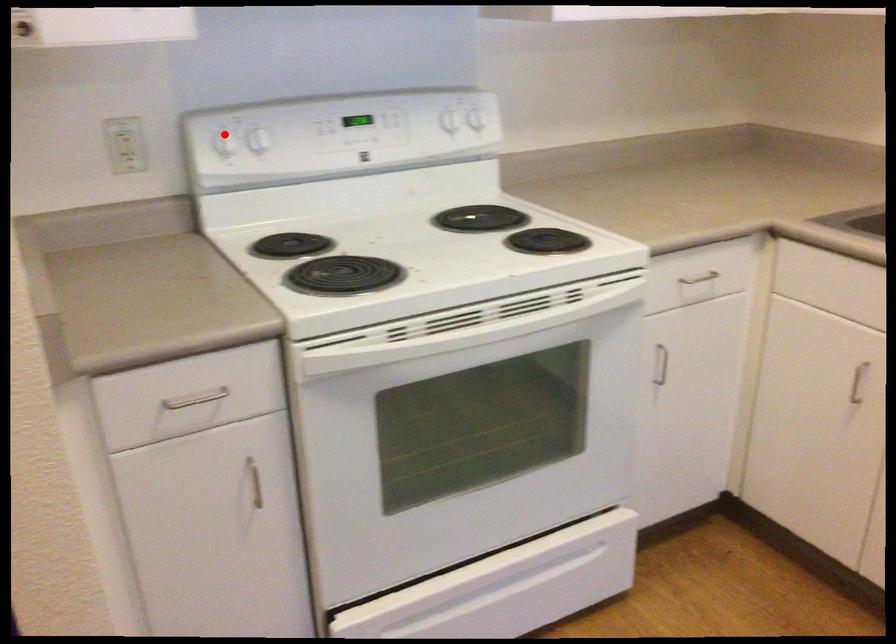
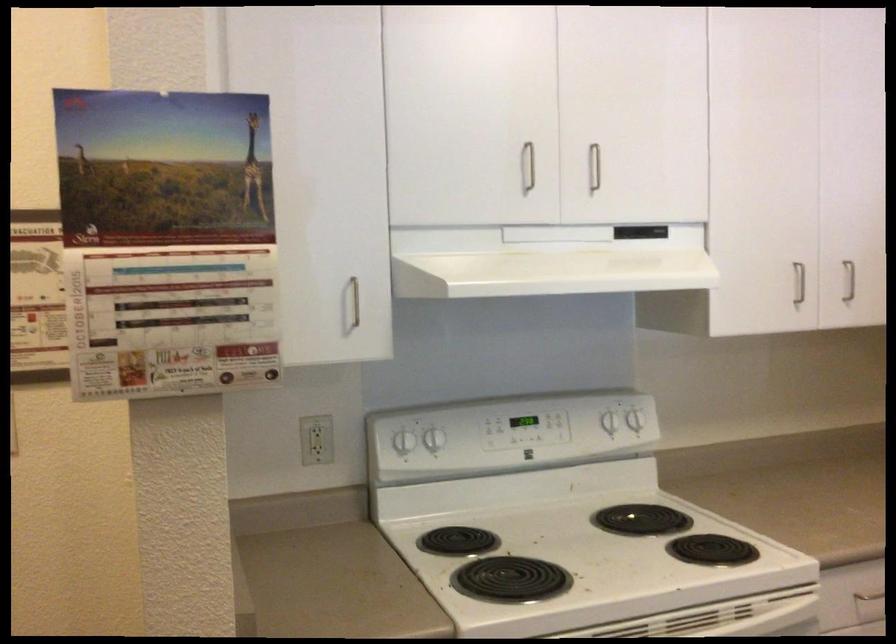
Find the pixel in the second image that matches the highlighted location in the first image.

(400, 433)